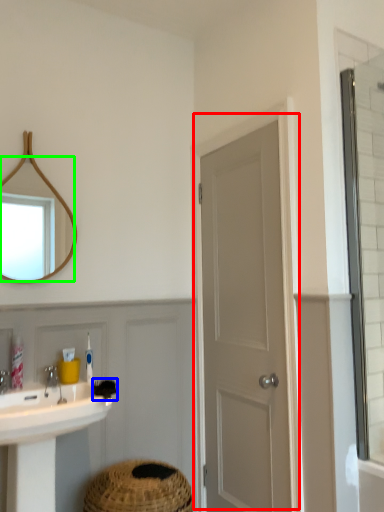
Question: Which object is positioned farthest from door (highlighted by a red box)? Select from brush (highlighted by a blue box) and mirror (highlighted by a green box).

Choices:
 (A) brush
 (B) mirror

Answer: (B)